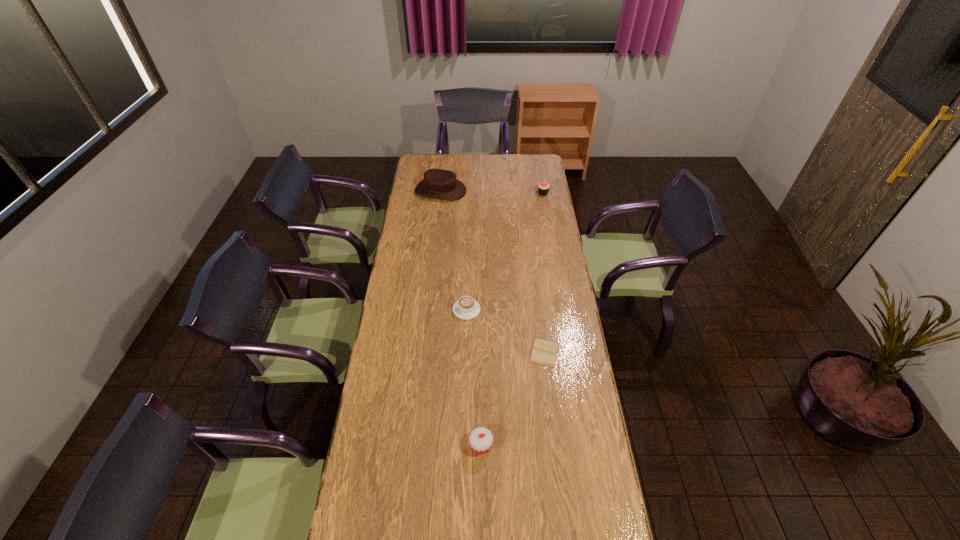
This screenshot has height=540, width=960. I want to click on object that is the closest to the farther cupcake, so [x=438, y=183].

This screenshot has width=960, height=540. What are the coordinates of `free space that satisfies the following two spatial constraints: 1. on the back side of the farther cupcake; 2. on the right side of the fourth farthest object` in the screenshot? It's located at (525, 193).

I want to click on vacant space that satisfies the following two spatial constraints: 1. with the handle on the right side of the third farthest object; 2. on the left side of the diary, so click(x=466, y=352).

The image size is (960, 540). In order to click on vacant point that satisfies the following two spatial constraints: 1. with the handle on the right side of the shortest object; 2. on the right side of the second shortest object in this screenshot , I will do `click(466, 352)`.